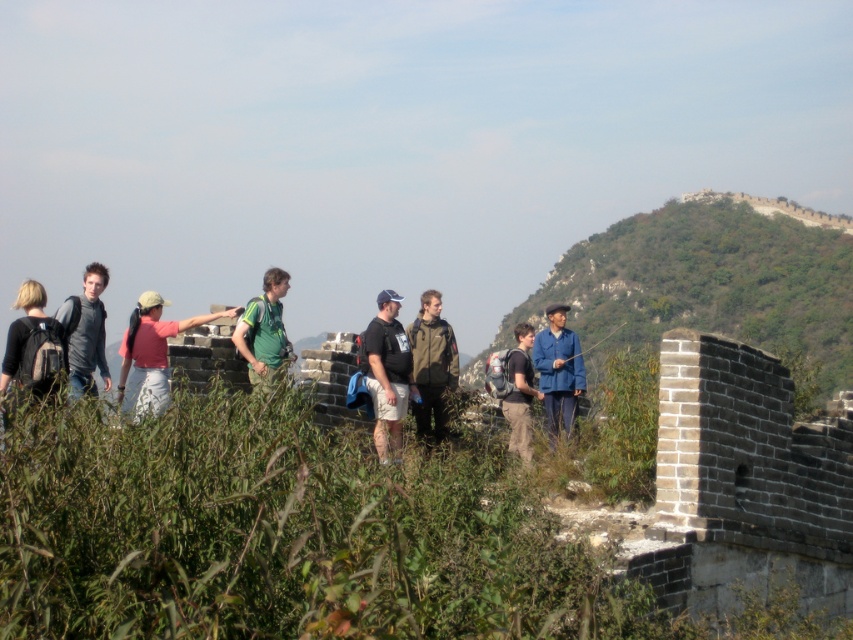
Is green grassy hillside at upper right positioned before green fabric backpack at center?

That is False.

Between green grassy hillside at upper right and green fabric backpack at center, which one appears on the right side from the viewer's perspective?

green grassy hillside at upper right

Is point (608, 273) positioned after point (259, 332)?

That is True.

In order to click on green grassy hillside at upper right in this screenshot , I will do `click(704, 285)`.

Is blue fabric jacket at center thinner than dark gray fabric backpack at center?

Indeed, blue fabric jacket at center has a lesser width compared to dark gray fabric backpack at center.

Between point (561, 397) and point (524, 326), which one is positioned in front?

Positioned in front is point (561, 397).

Is point (581, 392) more distant than point (508, 369)?

No.

Locate an element on the screen. The image size is (853, 640). blue fabric jacket at center is located at coordinates (558, 371).

Between green grassy hillside at upper right and matte gray shirt at left, which one appears on the right side from the viewer's perspective?

From the viewer's perspective, green grassy hillside at upper right appears more on the right side.

Is green grassy hillside at upper right bigger than matte gray shirt at left?

Yes, green grassy hillside at upper right is bigger than matte gray shirt at left.

Does point (819, 365) come farther from viewer compared to point (80, 349)?

Yes, point (819, 365) is farther from viewer.

The image size is (853, 640). I want to click on green grassy hillside at upper right, so click(704, 285).